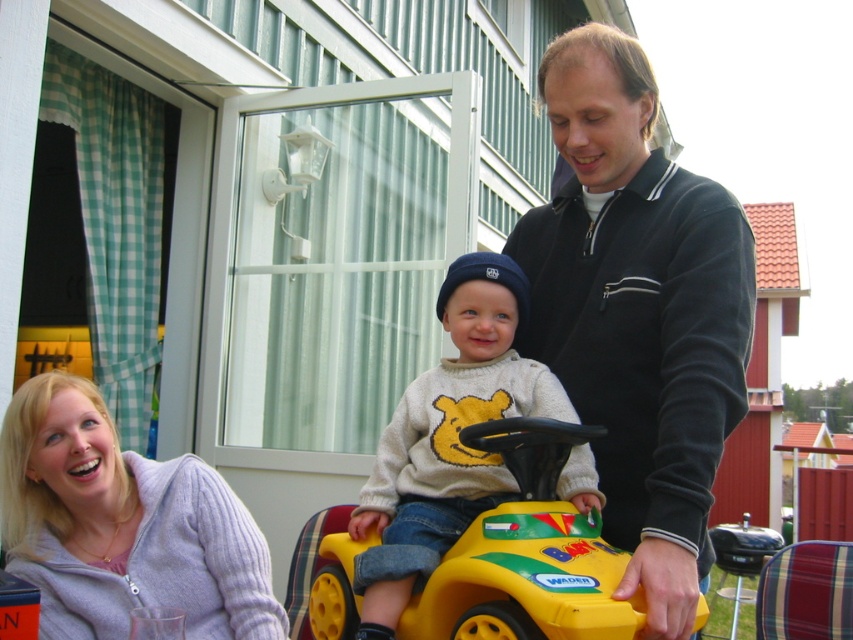
You are standing in the backyard and want to walk from point (131, 525) to point (560, 592). Which direction should you move relative to your current position?

You should move away from yourself because point (131, 525) is closer to you than point (560, 592).